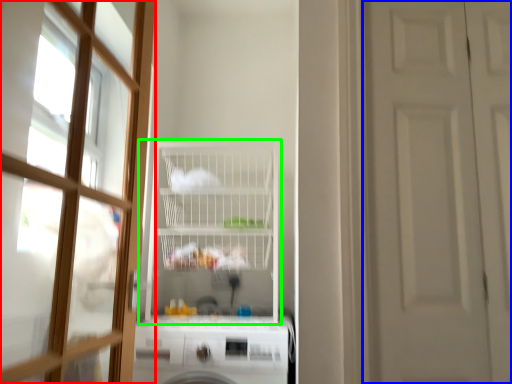
Question: Considering the real-world distances, which object is closest to door (highlighted by a red box)? door (highlighted by a blue box) or shelf (highlighted by a green box).

Choices:
 (A) door
 (B) shelf

Answer: (B)